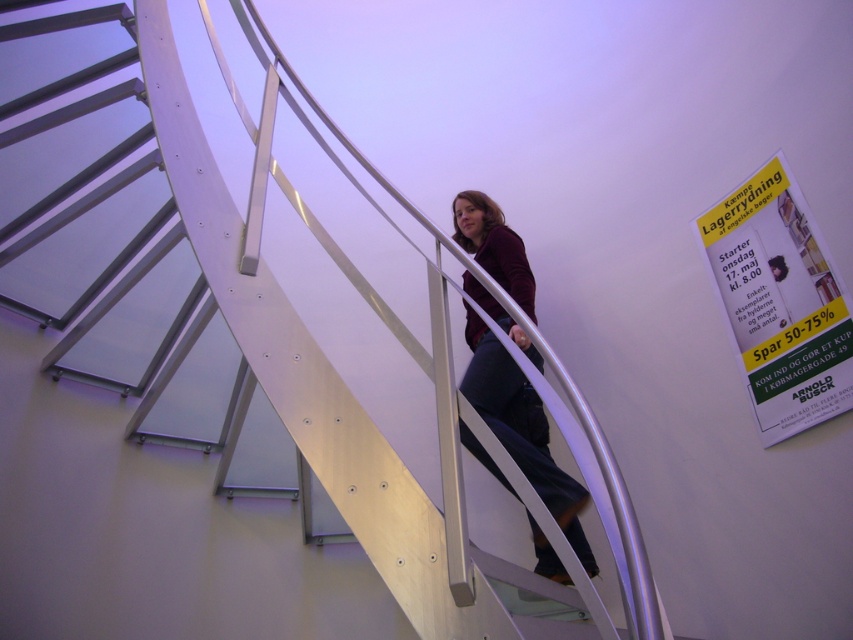
Does yellow paper poster at upper right appear over matte maroon sweater at center?

Correct, yellow paper poster at upper right is located above matte maroon sweater at center.

Who is more distant from viewer, (785,310) or (471,221)?

Positioned behind is point (471,221).

You are a GUI agent. You are given a task and a screenshot of the screen. Output one action in this format:
    pyautogui.click(x=<x>, y=<y>)
    Task: Click on the yellow paper poster at upper right
    This screenshot has width=853, height=640.
    Given the screenshot: What is the action you would take?
    pyautogui.click(x=779, y=301)